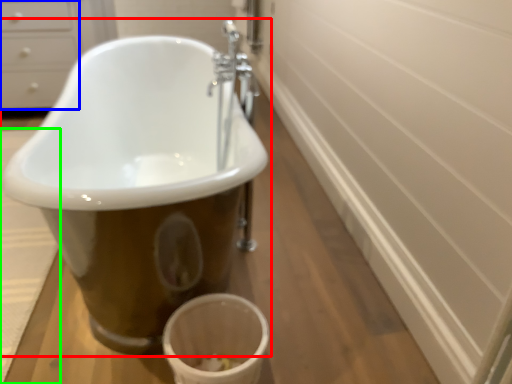
Question: Considering the real-world distances, which object is farthest from bathtub (highlighted by a red box)? drawer (highlighted by a blue box) or bath mat (highlighted by a green box)?

Choices:
 (A) drawer
 (B) bath mat

Answer: (A)